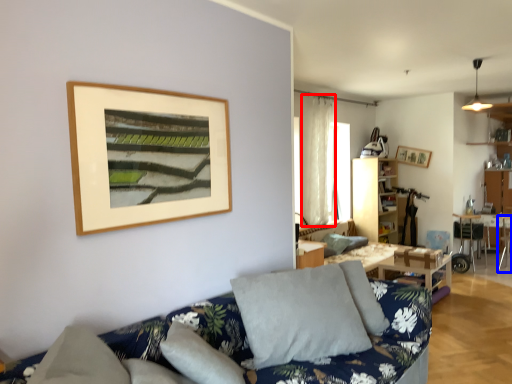
Question: Among these objects, which one is nearest to the camera, curtain (highlighted by a red box) or armchair (highlighted by a blue box)?

Choices:
 (A) curtain
 (B) armchair

Answer: (A)